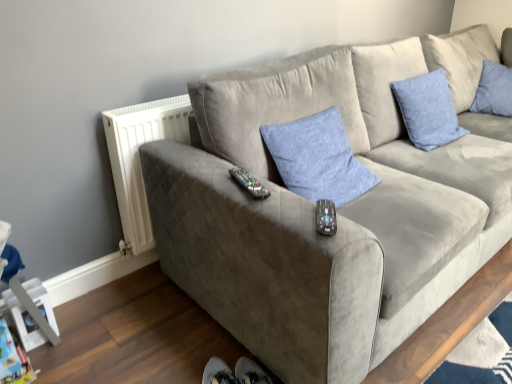
Question: Does black plastic remote at center, marked as the second remote in a bottom-to-top arrangement, have a smaller size compared to white plastic radiator at left?

Choices:
 (A) yes
 (B) no

Answer: (A)

Question: Can you confirm if black plastic remote at center, marked as the second remote in a bottom-to-top arrangement, is positioned to the left of white plastic radiator at left?

Choices:
 (A) no
 (B) yes

Answer: (A)

Question: From the image's perspective, is black plastic remote at center, marked as the second remote in a bottom-to-top arrangement, located above white plastic radiator at left?

Choices:
 (A) yes
 (B) no

Answer: (B)

Question: Does black plastic remote at center, which appears as the second remote when viewed from the front, have a lesser height compared to white plastic radiator at left?

Choices:
 (A) yes
 (B) no

Answer: (A)

Question: From a real-world perspective, is black plastic remote at center, acting as the 2th remote starting from the right, on top of white plastic radiator at left?

Choices:
 (A) no
 (B) yes

Answer: (B)

Question: In the image, is blue textured pillow at upper right, which appears as the 2th pillow when viewed from the front, positioned in front of or behind black plastic remote at center, which is the first remote in top-to-bottom order?

Choices:
 (A) front
 (B) behind

Answer: (B)

Question: Is point (417, 137) closer or farther from the camera than point (237, 173)?

Choices:
 (A) closer
 (B) farther

Answer: (B)

Question: In the image, is blue textured pillow at upper right, which appears as the 2th pillow when viewed from the front, on the left side or the right side of black plastic remote at center, acting as the 1th remote starting from the left?

Choices:
 (A) right
 (B) left

Answer: (A)

Question: From the image's perspective, is blue textured pillow at upper right, the first pillow when ordered from right to left, located above or below black plastic remote at center, which appears as the second remote when viewed from the front?

Choices:
 (A) above
 (B) below

Answer: (A)

Question: Is white plastic radiator at left to the left or to the right of blue fabric pillow at center, marked as the 1th pillow in a front-to-back arrangement, in the image?

Choices:
 (A) right
 (B) left

Answer: (B)

Question: From the image's perspective, is white plastic radiator at left above or below blue fabric pillow at center, the 2th pillow viewed from the right?

Choices:
 (A) below
 (B) above

Answer: (A)

Question: Considering the positions of point (144, 129) and point (263, 132), is point (144, 129) closer or farther from the camera than point (263, 132)?

Choices:
 (A) farther
 (B) closer

Answer: (A)

Question: Considering the positions of white plastic radiator at left and blue fabric pillow at center, marked as the 1th pillow in a front-to-back arrangement, in the image, is white plastic radiator at left taller or shorter than blue fabric pillow at center, marked as the 1th pillow in a front-to-back arrangement,?

Choices:
 (A) tall
 (B) short

Answer: (A)

Question: In terms of height, does black plastic remote at center, arranged as the first remote when viewed from the front, look taller or shorter compared to blue fabric pillow at center, marked as the 1th pillow in a front-to-back arrangement?

Choices:
 (A) tall
 (B) short

Answer: (B)

Question: In the image, is black plastic remote at center, positioned as the 2th remote in back-to-front order, on the left side or the right side of blue fabric pillow at center, the 2th pillow viewed from the right?

Choices:
 (A) left
 (B) right

Answer: (A)